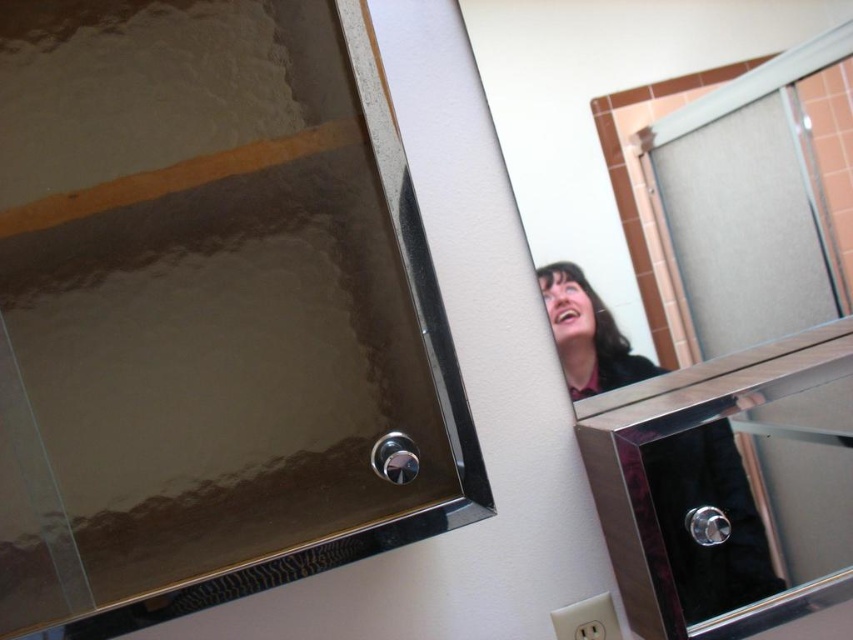
Question: Which point is farther from the camera taking this photo?

Choices:
 (A) (657, 205)
 (B) (474, 483)

Answer: (A)

Question: Is polished chrome mirror at upper right positioned behind shiny silver mirror at upper right?

Choices:
 (A) yes
 (B) no

Answer: (A)

Question: Which object is closer to the camera taking this photo?

Choices:
 (A) polished chrome mirror at upper right
 (B) glossy metallic mirror at upper center

Answer: (B)

Question: Which point is farther to the camera?

Choices:
 (A) (843, 19)
 (B) (206, 100)
 (C) (598, 387)

Answer: (A)

Question: Observing the image, what is the correct spatial positioning of glossy metallic mirror at upper center in reference to shiny silver mirror at upper right?

Choices:
 (A) above
 (B) below

Answer: (A)

Question: Can you confirm if glossy metallic mirror at upper center is positioned below polished chrome mirror at upper right?

Choices:
 (A) yes
 (B) no

Answer: (A)